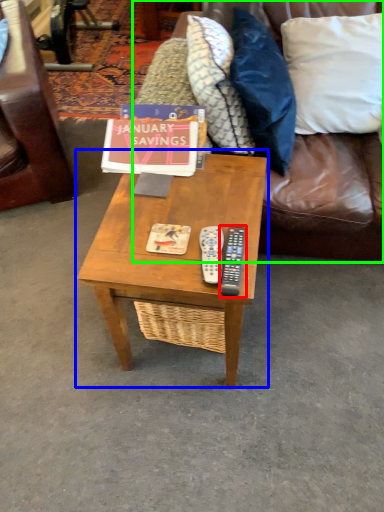
Question: Which object is positioned farthest from remote (highlighted by a red box)? Select from coffee table (highlighted by a blue box) and studio couch (highlighted by a green box).

Choices:
 (A) coffee table
 (B) studio couch

Answer: (B)